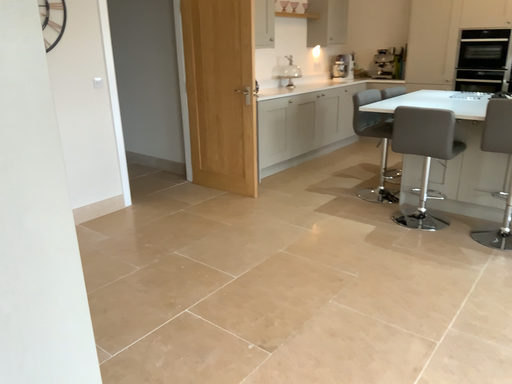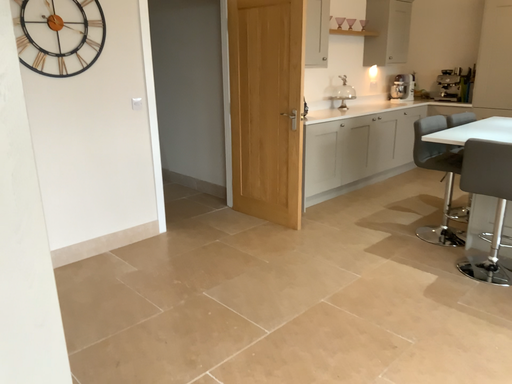
Question: How did the camera likely rotate when shooting the video?

Choices:
 (A) rotated right
 (B) rotated left

Answer: (B)